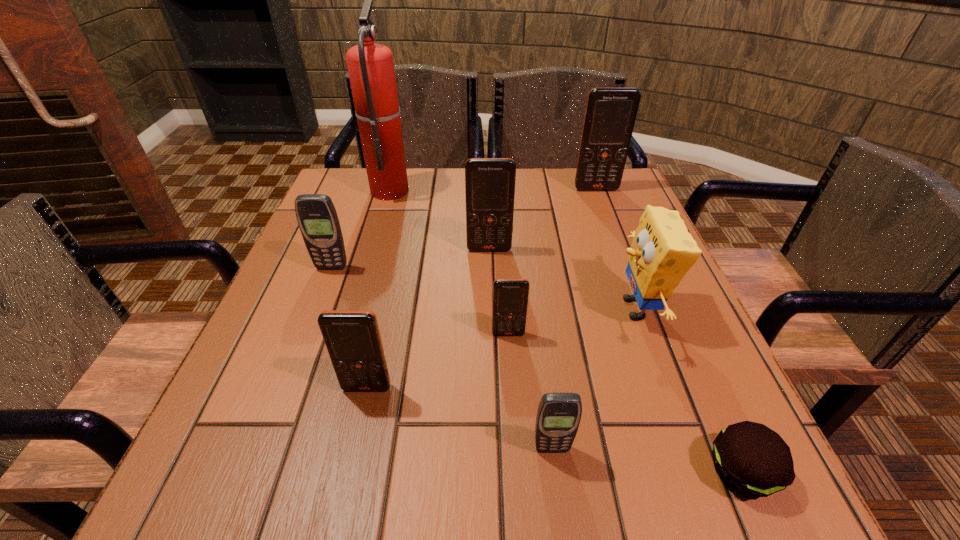
Find the location of a particular element. The height and width of the screenshot is (540, 960). the third nearest object is located at coordinates (352, 337).

Identify the location of the fourth farthest cellular telephone. This screenshot has height=540, width=960. (510, 296).

Identify the location of the third farthest orange cellular telephone. (510, 296).

I want to click on the nearer gray cellular telephone, so click(558, 417).

Where is `the right gray cellular telephone`? the right gray cellular telephone is located at coordinates (558, 417).

The image size is (960, 540). Identify the location of the shortest object. (752, 459).

This screenshot has height=540, width=960. I want to click on free region located 0.250m with the nozzle and gauge on the red fire extinguisher, so click(502, 190).

Identify the location of vacant region located on the screen of the biggest orange cellular telephone. This screenshot has width=960, height=540. pyautogui.click(x=633, y=286).

Identify the location of blank space located on the screen of the second farthest cellular telephone. (491, 287).

The height and width of the screenshot is (540, 960). In order to click on blank area located 0.220m on the face of the yellow sponge in this screenshot , I will do `click(498, 308)`.